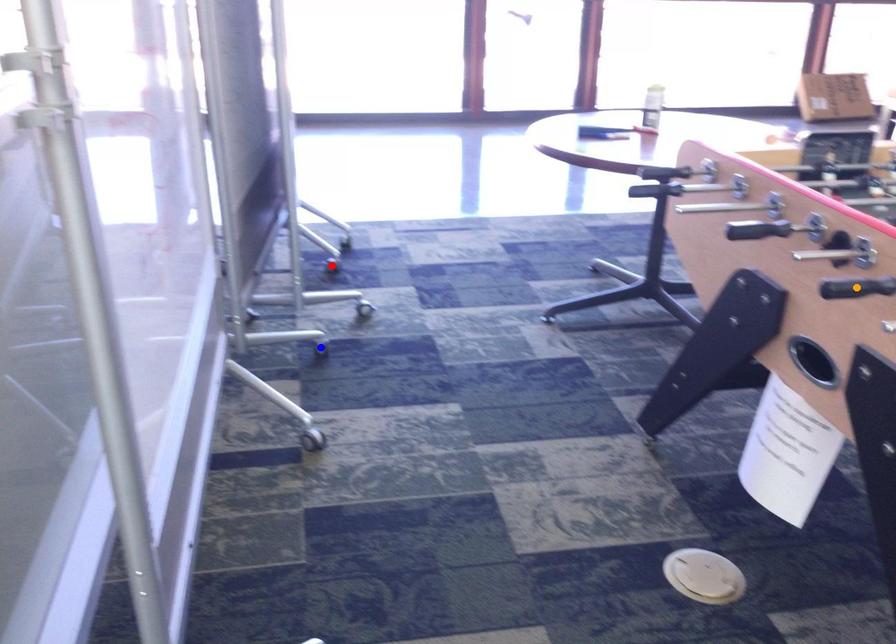
Order these from nearest to farthest:
orange point, red point, blue point

orange point
blue point
red point